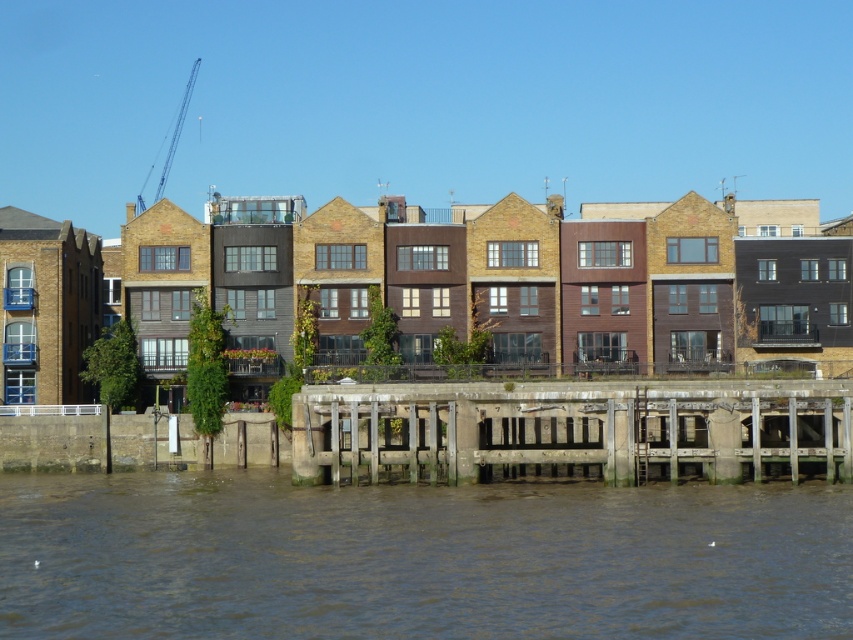
You are standing on the wooden planks at lower center and want to step onto the brown muddy water at lower center. Is it possible to do so without getting your feet wet?

The brown muddy water at lower center has a larger size compared to wooden planks at lower center. Since the water is larger, it likely covers the wooden planks, making it impossible to step onto the water without getting wet.

You are a construction worker on the pier and need to move a heavy load from the blue metallic crane at upper left to the brown muddy water at lower center. Can you safely lower the load directly below the crane?

Yes, the brown muddy water at lower center is positioned under the blue metallic crane at upper left, so the crane can safely lower the load directly below it.